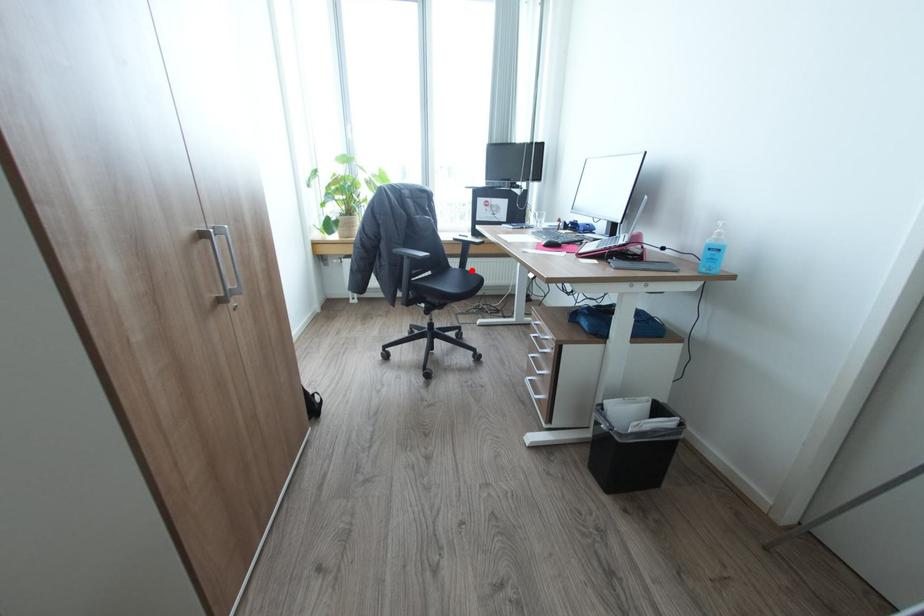
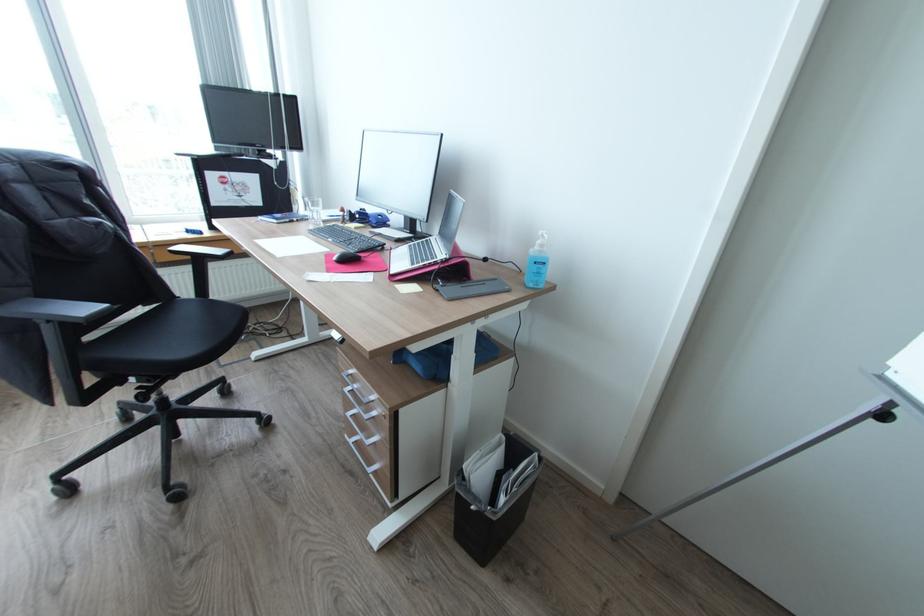
Locate, in the second image, the point that corresponds to the highlighted location in the first image.

(217, 300)